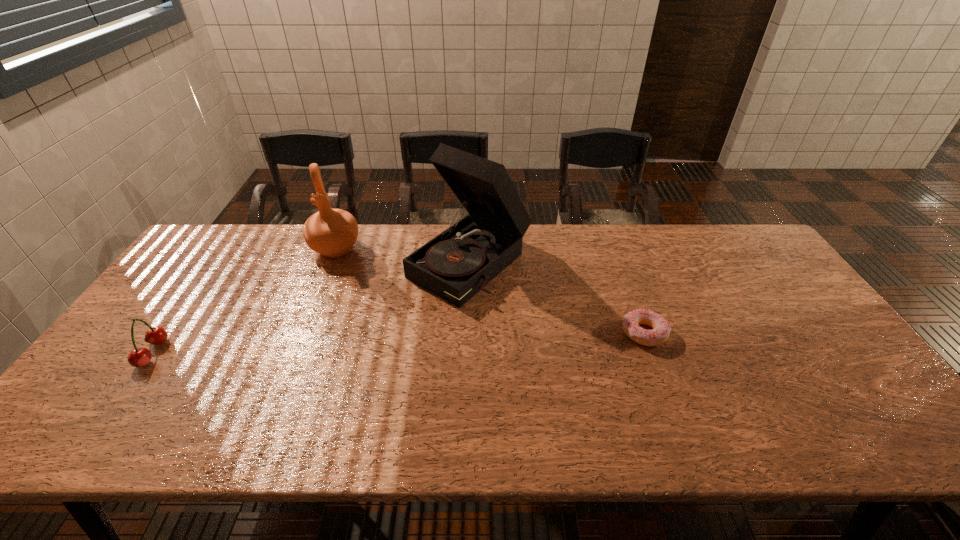
This screenshot has width=960, height=540. I want to click on free space between the second object from left to right and the phonograph_record, so click(x=403, y=255).

The width and height of the screenshot is (960, 540). I want to click on free space between the second tallest object and the second shortest object, so click(244, 301).

This screenshot has width=960, height=540. What are the coordinates of `vacant area that lies between the second object from left to right and the tallest object` in the screenshot? It's located at (403, 255).

Select which object appears as the second closest to the third shortest object. Please provide its 2D coordinates. Your answer should be formatted as a tuple, i.e. [(x, y)], where the tuple contains the x and y coordinates of a point satisfying the conditions above.

[(139, 357)]

At what (x,y) coordinates should I click in order to perform the action: click on object that ranks as the closest to the rightmost object. Please return your answer as a coordinate pair (x, y). The image size is (960, 540). Looking at the image, I should click on (455, 265).

The width and height of the screenshot is (960, 540). What are the coordinates of `vacant point that satisfies the following two spatial constraints: 1. on the front side of the second tallest object; 2. on the left side of the doughnut` in the screenshot? It's located at click(301, 334).